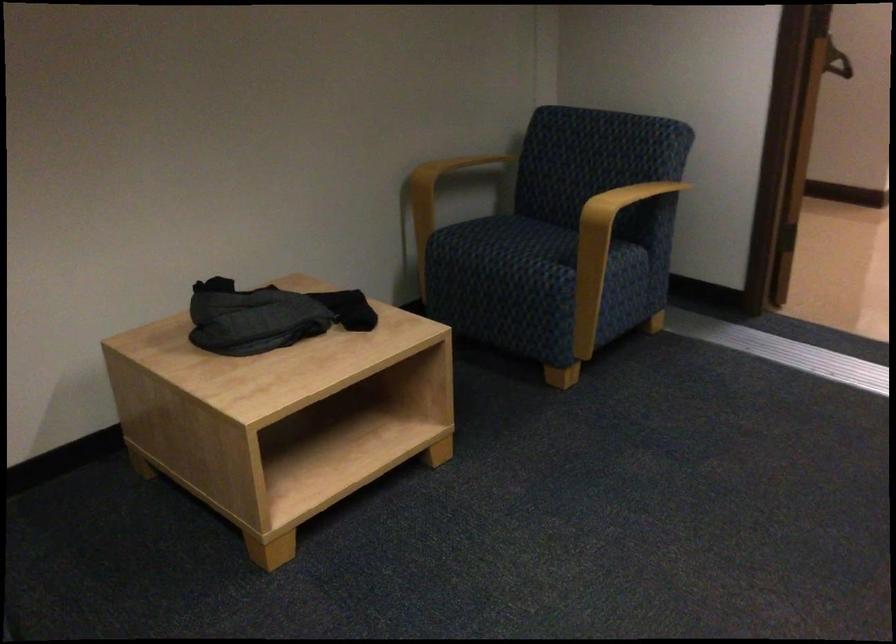
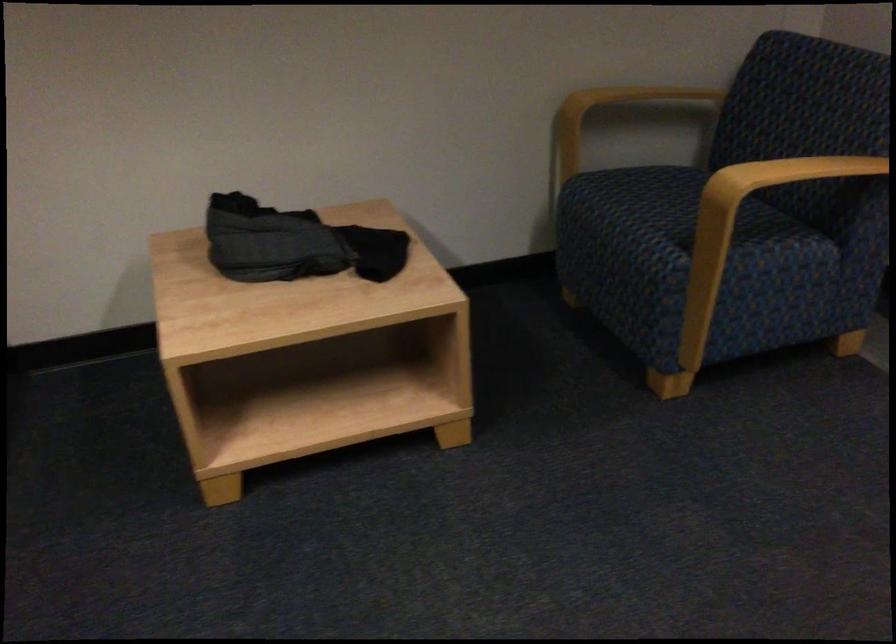
Where in the second image is the point corresponding to (571,228) from the first image?

(757, 196)